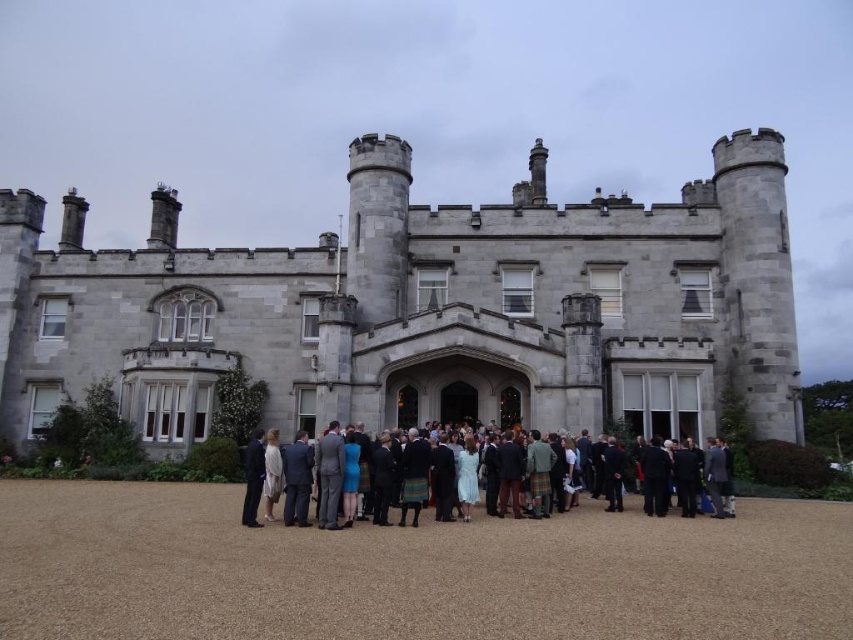
Between gray stone castle at center and matte black suit at center, which one has more height?

Standing taller between the two is gray stone castle at center.

This screenshot has height=640, width=853. In order to click on gray stone castle at center in this screenshot , I will do `click(422, 308)`.